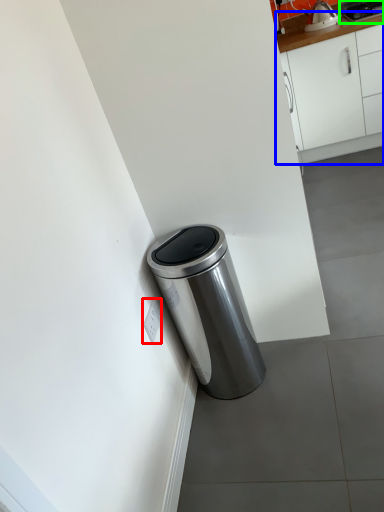
Question: Based on their relative distances, which object is nearer to electric outlet (highlighted by a red box)? Choose from cabinetry (highlighted by a blue box) and appliance (highlighted by a green box).

Choices:
 (A) cabinetry
 (B) appliance

Answer: (A)